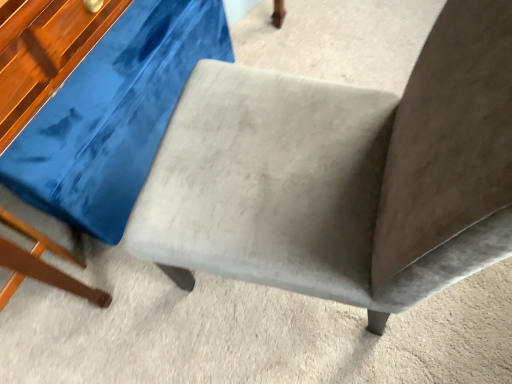
Where is `suede-like gray chair at center`? Image resolution: width=512 pixels, height=384 pixels. suede-like gray chair at center is located at coordinates (342, 174).

What do you see at coordinates (342, 174) in the screenshot?
I see `suede-like gray chair at center` at bounding box center [342, 174].

What do you see at coordinates (121, 111) in the screenshot? I see `suede gray swivel chair at center` at bounding box center [121, 111].

This screenshot has height=384, width=512. What are the coordinates of `suede gray swivel chair at center` in the screenshot? It's located at click(121, 111).

Measure the distance between suede gray swivel chair at center and camera.

suede gray swivel chair at center is 30.25 inches from camera.

This screenshot has height=384, width=512. In order to click on suede-like gray chair at center in this screenshot , I will do `click(342, 174)`.

Would you say suede gray swivel chair at center is to the left or to the right of suede-like gray chair at center in the picture?

suede gray swivel chair at center is to the left of suede-like gray chair at center.

Is suede gray swivel chair at center in front of suede-like gray chair at center?

No, suede gray swivel chair at center is further to the viewer.

Which is behind, point (95, 101) or point (381, 150)?

The point (95, 101) is behind.

From the image's perspective, is suede gray swivel chair at center positioned above or below suede-like gray chair at center?

suede gray swivel chair at center is situated higher than suede-like gray chair at center in the image.

From a real-world perspective, is suede gray swivel chair at center positioned above or below suede-like gray chair at center?

In terms of real-world spatial position, suede gray swivel chair at center is below suede-like gray chair at center.

Which of these two, suede gray swivel chair at center or suede-like gray chair at center, is wider?

suede gray swivel chair at center.

Between suede gray swivel chair at center and suede-like gray chair at center, which one has more height?

suede-like gray chair at center.

Between suede gray swivel chair at center and suede-like gray chair at center, which one has larger size?

suede-like gray chair at center.

Can we say suede gray swivel chair at center lies outside suede-like gray chair at center?

Yes, suede gray swivel chair at center is located beyond the bounds of suede-like gray chair at center.

Is suede gray swivel chair at center directly adjacent to suede-like gray chair at center?

No, suede gray swivel chair at center is not with suede-like gray chair at center.

Could you tell me if suede gray swivel chair at center is facing suede-like gray chair at center?

No, suede gray swivel chair at center is not aimed at suede-like gray chair at center.

How many degrees apart are the facing directions of suede gray swivel chair at center and suede-like gray chair at center?

suede gray swivel chair at center and suede-like gray chair at center are facing 76.7 degrees away from each other.

Measure the distance between suede gray swivel chair at center and suede-like gray chair at center.

The distance of suede gray swivel chair at center from suede-like gray chair at center is 45.82 centimeters.

In order to click on swivel chair behind the suede-like gray chair at center in this screenshot , I will do `click(121, 111)`.

Can you confirm if suede-like gray chair at center is positioned to the left of suede gray swivel chair at center?

In fact, suede-like gray chair at center is to the right of suede gray swivel chair at center.

Which object is closer to the camera taking this photo, suede-like gray chair at center or suede gray swivel chair at center?

Positioned in front is suede-like gray chair at center.

Which is behind, point (480, 195) or point (87, 171)?

The point (87, 171) is more distant.

From the image's perspective, is suede-like gray chair at center positioned above or below suede gray swivel chair at center?

From the image's perspective, suede-like gray chair at center appears below suede gray swivel chair at center.

From a real-world perspective, is suede-like gray chair at center located beneath suede gray swivel chair at center?

Actually, suede-like gray chair at center is physically above suede gray swivel chair at center in the real world.

Looking at their sizes, would you say suede-like gray chair at center is wider or thinner than suede gray swivel chair at center?

Considering their sizes, suede-like gray chair at center looks slimmer than suede gray swivel chair at center.

Which of these two, suede-like gray chair at center or suede gray swivel chair at center, stands shorter?

suede gray swivel chair at center.

Considering the sizes of objects suede-like gray chair at center and suede gray swivel chair at center in the image provided, who is bigger, suede-like gray chair at center or suede gray swivel chair at center?

Bigger between the two is suede-like gray chair at center.

Choose the correct answer: Is suede-like gray chair at center inside suede gray swivel chair at center or outside it?

suede-like gray chair at center cannot be found inside suede gray swivel chair at center.

Is suede-like gray chair at center next to suede gray swivel chair at center?

suede-like gray chair at center is not next to suede gray swivel chair at center, and they're not touching.

Does suede-like gray chair at center turn towards suede gray swivel chair at center?

Yes.

What's the angular difference between suede-like gray chair at center and suede gray swivel chair at center's facing directions?

The angle between the facing direction of suede-like gray chair at center and the facing direction of suede gray swivel chair at center is 76.7 degrees.

This screenshot has width=512, height=384. I want to click on swivel chair below the suede-like gray chair at center (from a real-world perspective), so click(121, 111).

Where is `chair positioned vertically above the suede gray swivel chair at center (from a real-world perspective)`? The image size is (512, 384). chair positioned vertically above the suede gray swivel chair at center (from a real-world perspective) is located at coordinates (342, 174).

Find the location of `chair that is in front of the suede gray swivel chair at center`. chair that is in front of the suede gray swivel chair at center is located at coordinates (342, 174).